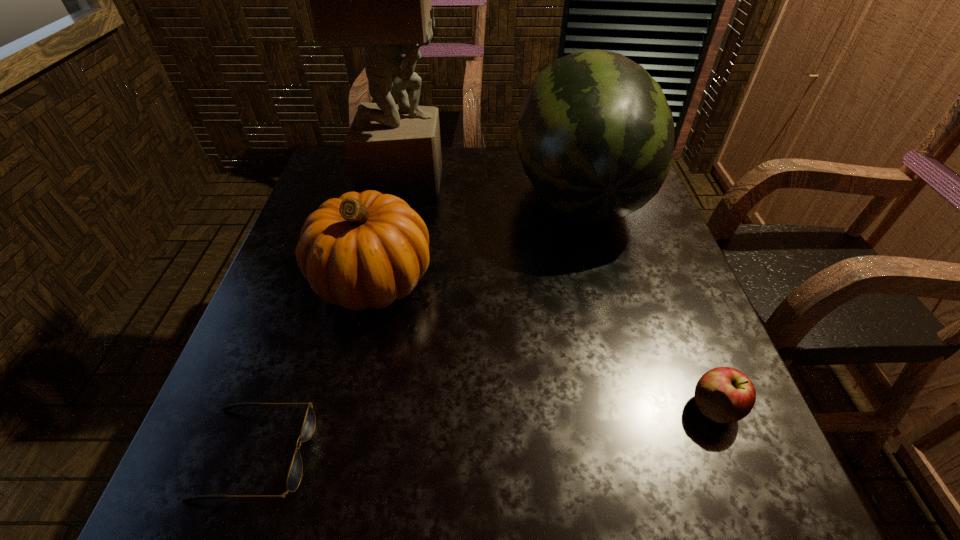
The height and width of the screenshot is (540, 960). Find the location of `sculpture present at the far edge`. sculpture present at the far edge is located at coordinates (381, 0).

Locate an element on the screen. watermelon positioned at the far edge is located at coordinates (595, 136).

This screenshot has height=540, width=960. In order to click on object situated at the near edge in this screenshot , I will do `click(294, 477)`.

Locate an element on the screen. sculpture present at the left edge is located at coordinates (381, 0).

The image size is (960, 540). In order to click on pumpkin located in the left edge section of the desktop in this screenshot , I will do `click(361, 250)`.

Where is `sunglasses that is positioned at the left edge`? sunglasses that is positioned at the left edge is located at coordinates (294, 477).

Find the location of `watermelon that is at the right edge`. watermelon that is at the right edge is located at coordinates (595, 136).

Find the location of a particular element. apple that is at the right edge is located at coordinates (723, 394).

At what (x,y) coordinates should I click in order to perform the action: click on object at the far left corner. Please return your answer as a coordinate pair (x, y). This screenshot has height=540, width=960. Looking at the image, I should click on (381, 0).

Identify the location of object that is at the near left corner. (294, 477).